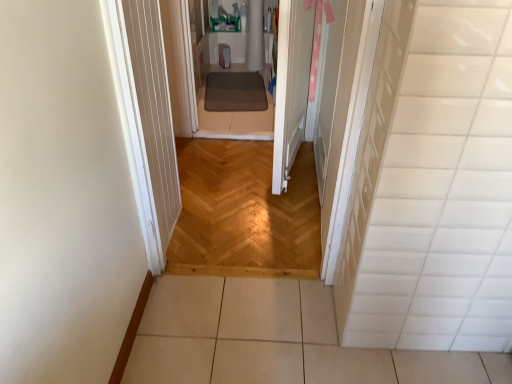
Question: Considering the positions of white glossy tile at right and brown textured mat at center in the image, is white glossy tile at right taller or shorter than brown textured mat at center?

Choices:
 (A) short
 (B) tall

Answer: (B)

Question: Is white glossy tile at right situated inside brown textured mat at center or outside?

Choices:
 (A) inside
 (B) outside

Answer: (B)

Question: Considering the real-world distances, which object is farthest from the white wood door at center?

Choices:
 (A) white glossy tile at right
 (B) brown textured mat at center
 (C) natural wood floor at center
 (D) white tile floor at lower center

Answer: (A)

Question: Estimate the real-world distances between objects in this image. Which object is closer to the white glossy tile at right?

Choices:
 (A) brown textured mat at center
 (B) white wood door at center
 (C) natural wood floor at center
 (D) white tile floor at lower center

Answer: (D)